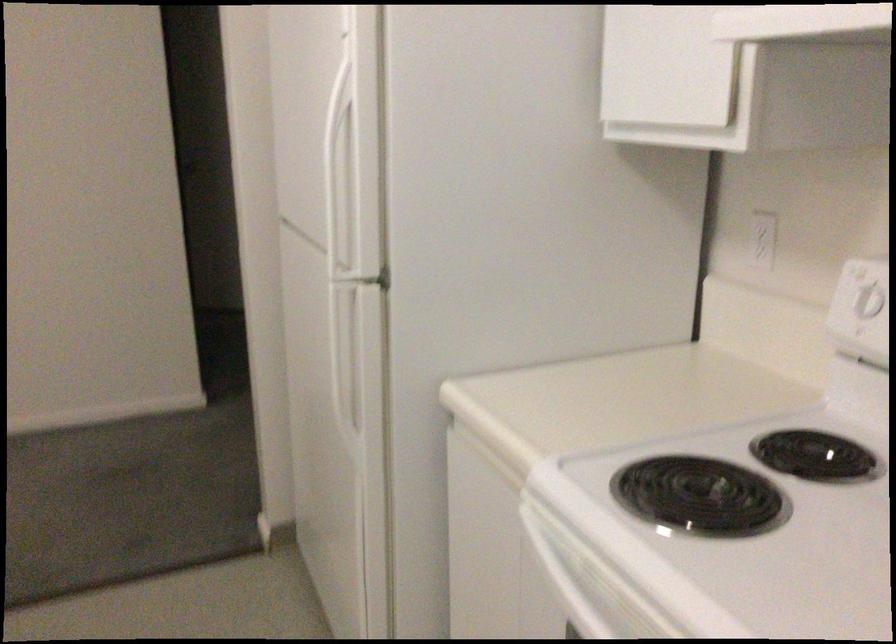
Find the location of a particular element. white cabinet door is located at coordinates (665, 67).